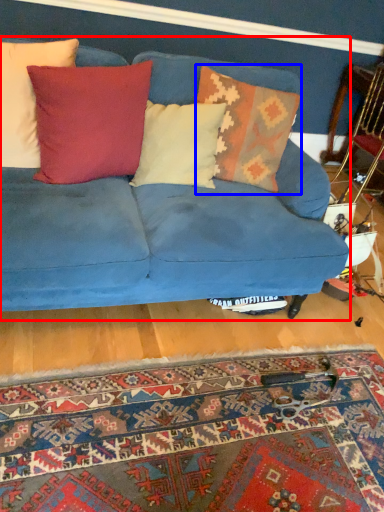
Question: Which object is closer to the camera taking this photo, studio couch (highlighted by a red box) or pillow (highlighted by a blue box)?

Choices:
 (A) studio couch
 (B) pillow

Answer: (A)